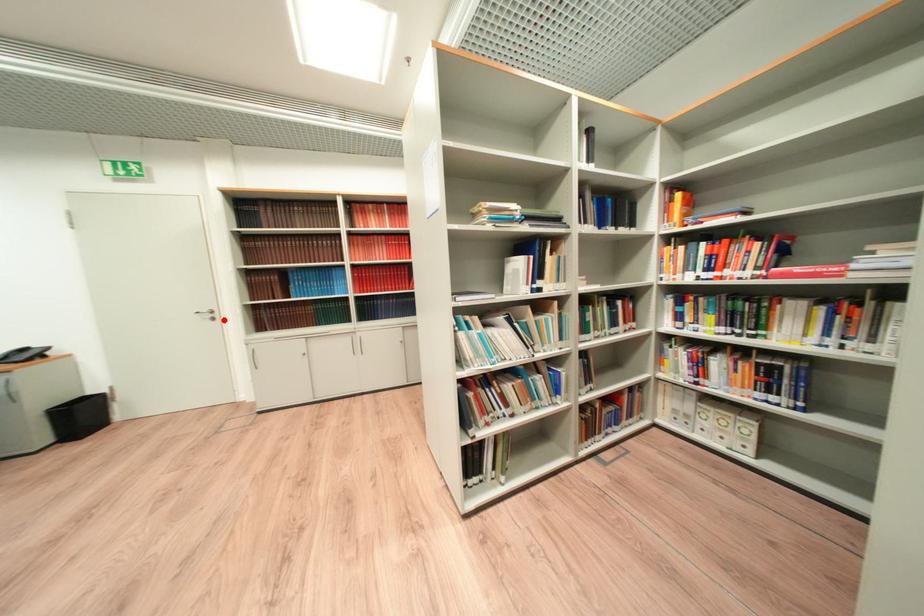
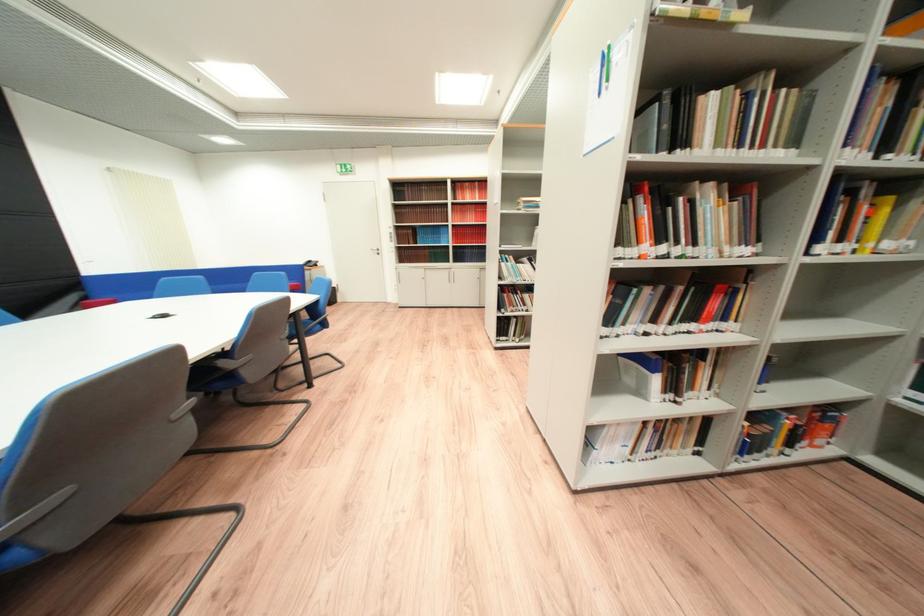
The point at the highlighted location is marked in the first image. Where is the corresponding point in the second image?

(388, 254)